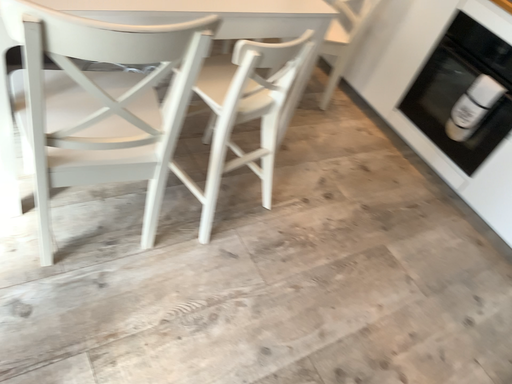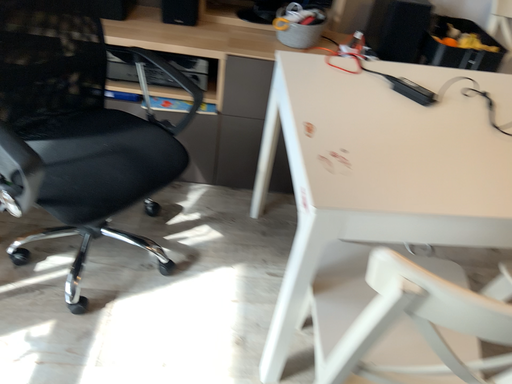
Question: How did the camera likely rotate when shooting the video?

Choices:
 (A) rotated upward
 (B) rotated downward

Answer: (A)